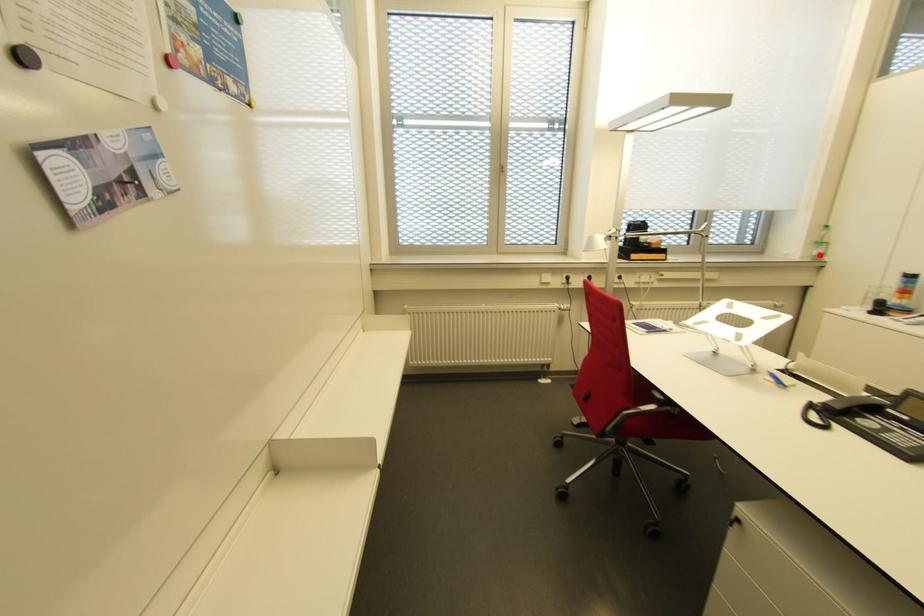
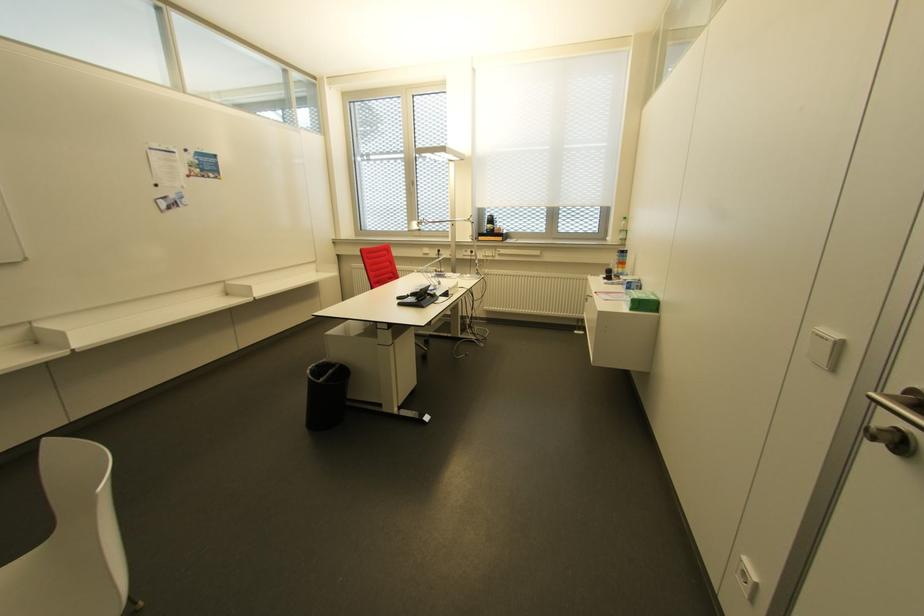
Question: I am providing you with two images of the same scene from different viewpoints. A red point is marked on the first image. At the location where the point appears in image 1, is it still visible in image 2?

Choices:
 (A) Yes
 (B) No

Answer: (A)